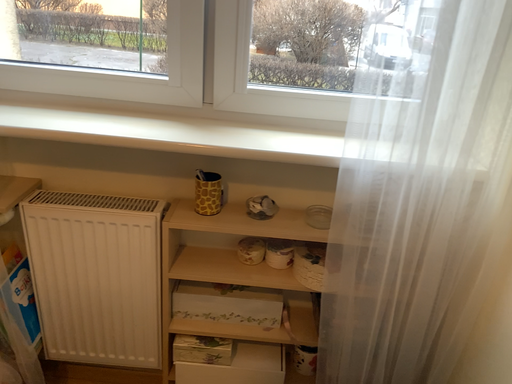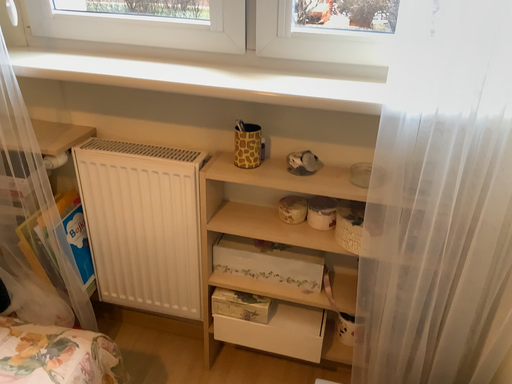
Question: How did the camera likely rotate when shooting the video?

Choices:
 (A) rotated right
 (B) rotated left

Answer: (B)